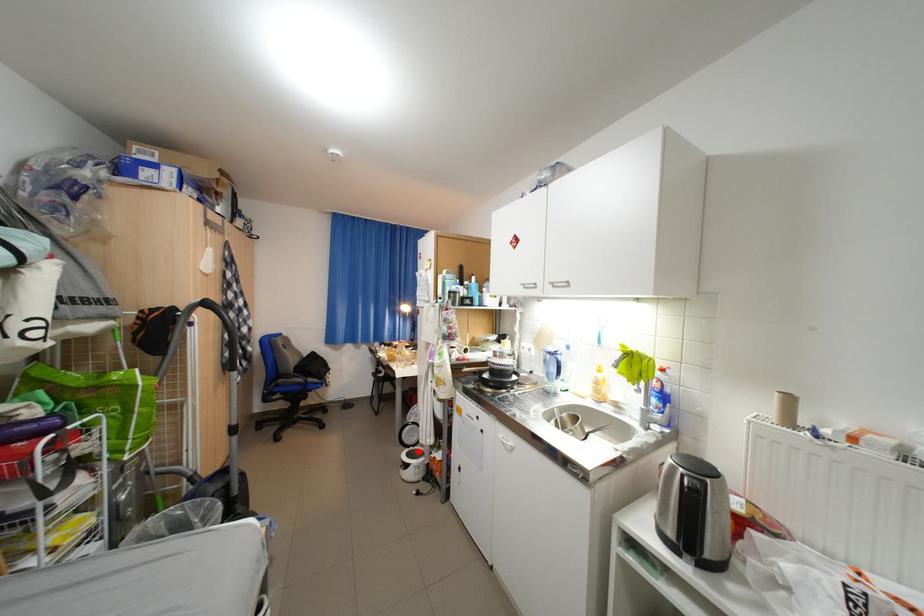
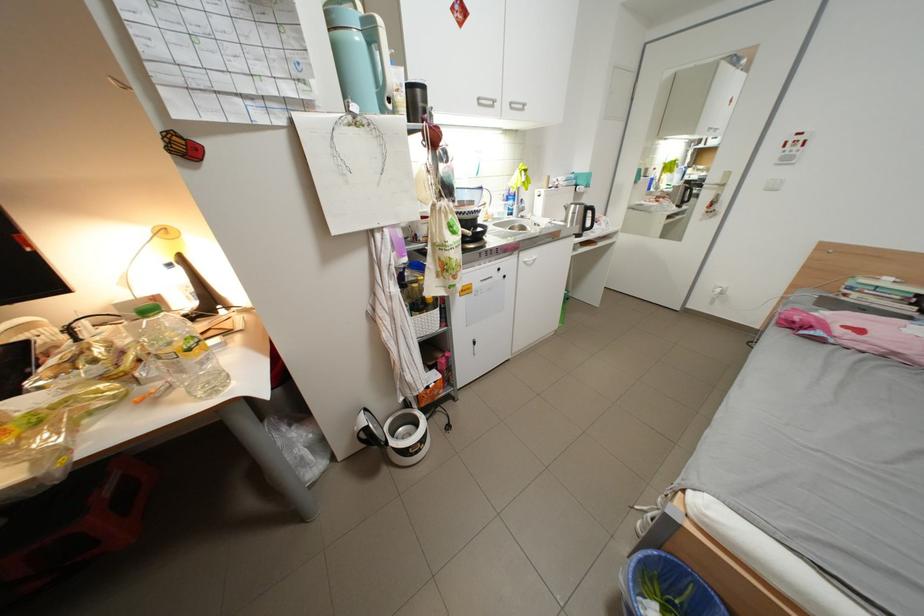
Locate, in the second image, the point that corresponds to the highlighted location in the first image.

(404, 444)